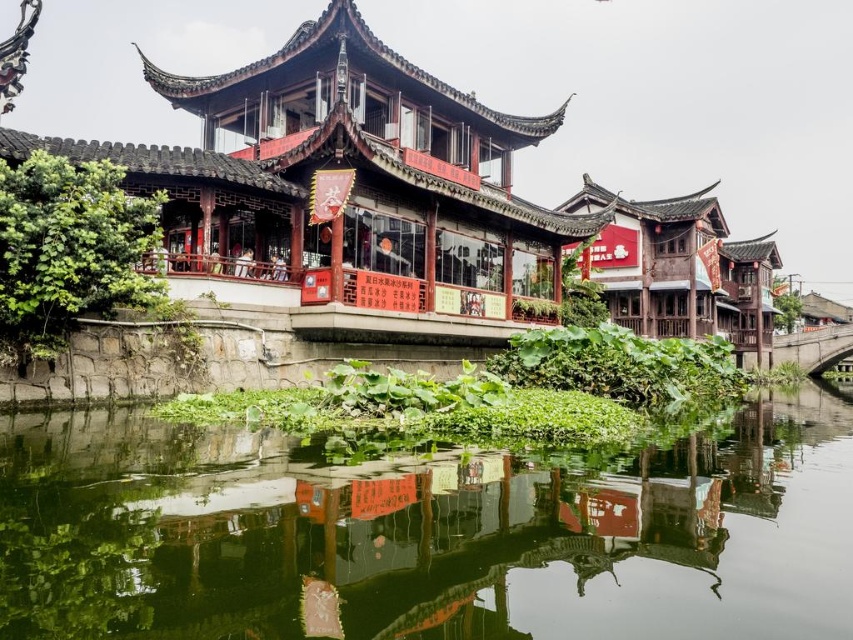
This screenshot has height=640, width=853. What do you see at coordinates (68, 250) in the screenshot? I see `green leafy plant at center-left` at bounding box center [68, 250].

This screenshot has height=640, width=853. In order to click on green leafy plant at center-left in this screenshot , I will do coord(68,250).

From the picture: Does green reflective water at center have a greater height compared to green leafy plant at center?

No, green reflective water at center is not taller than green leafy plant at center.

Between green reflective water at center and green leafy plant at center, which one appears on the right side from the viewer's perspective?

Positioned to the right is green leafy plant at center.

You are a GUI agent. You are given a task and a screenshot of the screen. Output one action in this format:
    pyautogui.click(x=<x>, y=<y>)
    Task: Click on the green reflective water at center
    Image resolution: width=853 pixels, height=640 pixels.
    Given the screenshot: What is the action you would take?
    pyautogui.click(x=425, y=532)

Identify the location of green reflective water at center. The image size is (853, 640). (425, 532).

How much distance is there between green reflective water at center and green leafy plant at center-left?

5.45 meters

Measure the distance between point [817,616] and camera.

9.69 meters

Where is `green reflective water at center`? This screenshot has height=640, width=853. green reflective water at center is located at coordinates (425, 532).